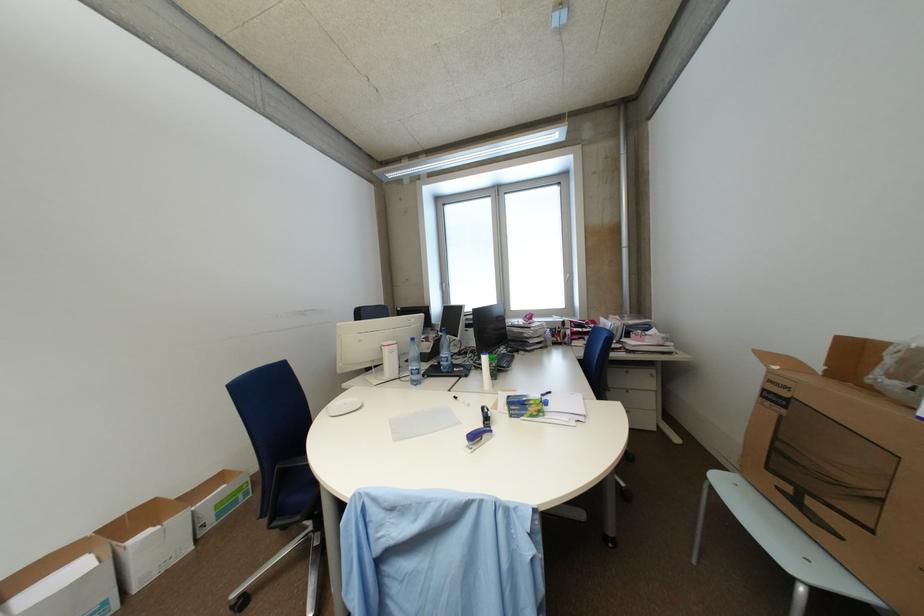
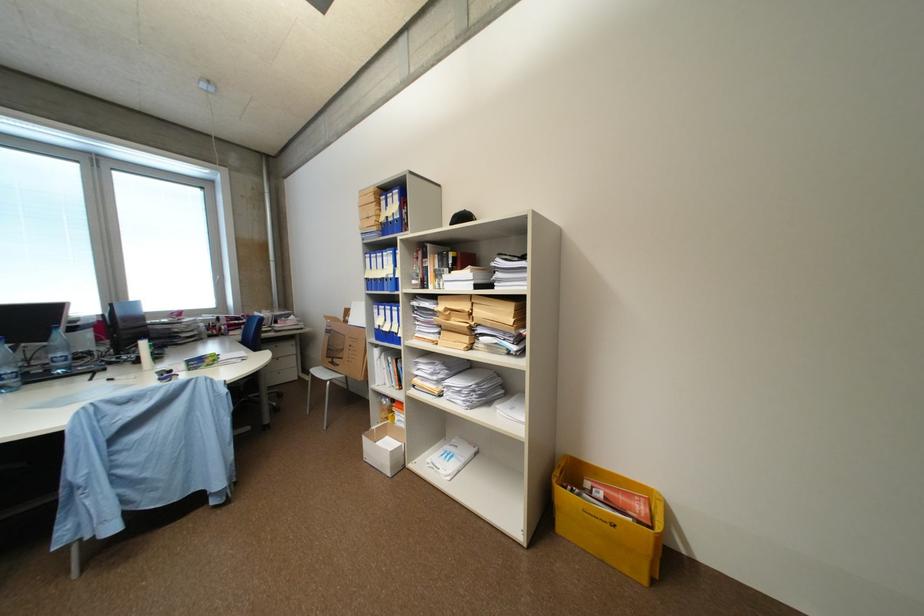
Find the pixel in the second image that matches point 784,451 in the first image.

(336, 350)